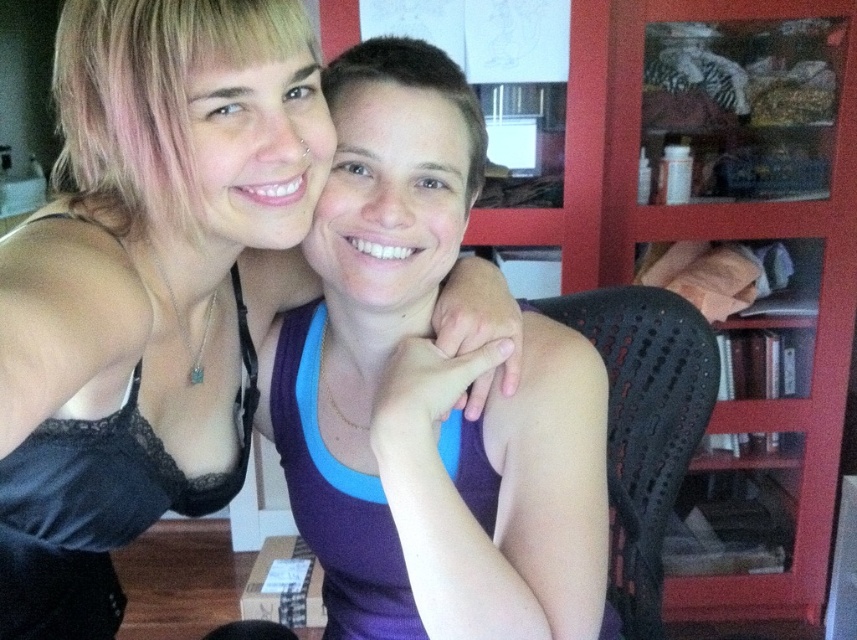
You are designing a clothing catalog and need to place the black lace tank top at upper left and the purple fabric tank top at center in a layout. Which tank top should you allocate more space to in the catalog layout?

The black lace tank top at upper left is bigger than the purple fabric tank top at center, so you should allocate more space to the black lace tank top at upper left in the catalog layout.

You are a tailor measuring the distance between two tank tops in the image. The black lace tank top at upper left and the purple fabric tank top at center are both on display. Can you fit a 4.5 inch wide measuring tape between them?

The black lace tank top at upper left is 5.53 inches from the purple fabric tank top at center, so yes, the 4.5 inch wide measuring tape can fit between them since the distance is greater than the tape width.